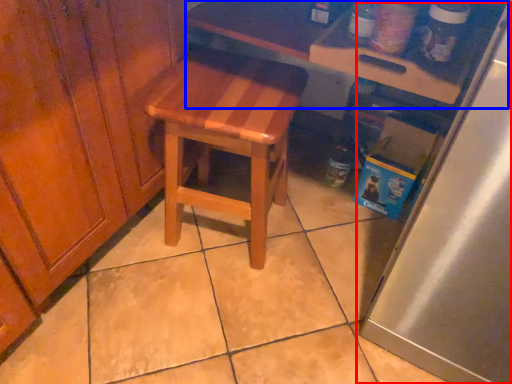
Question: Which object is further to the camera taking this photo, appliance (highlighted by a red box) or table (highlighted by a blue box)?

Choices:
 (A) appliance
 (B) table

Answer: (B)